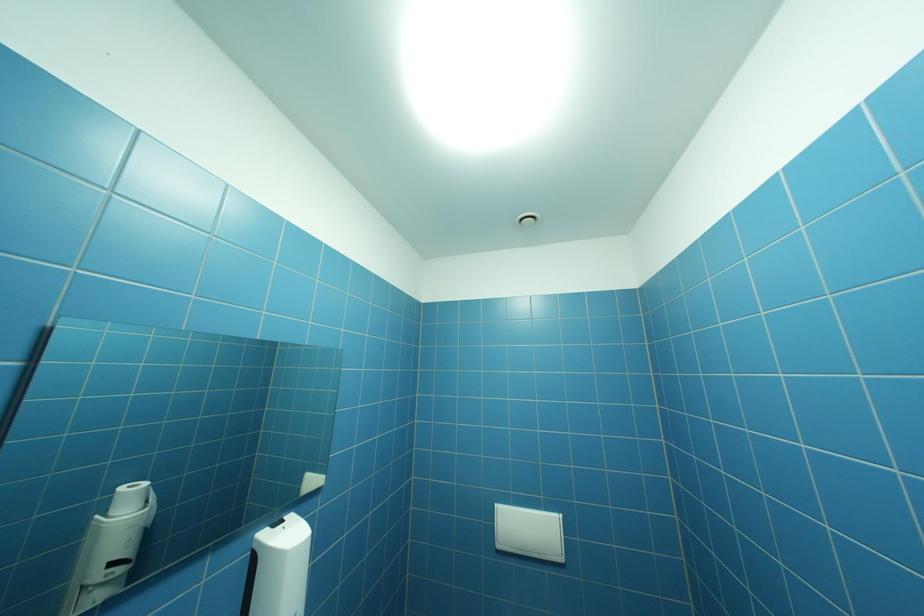
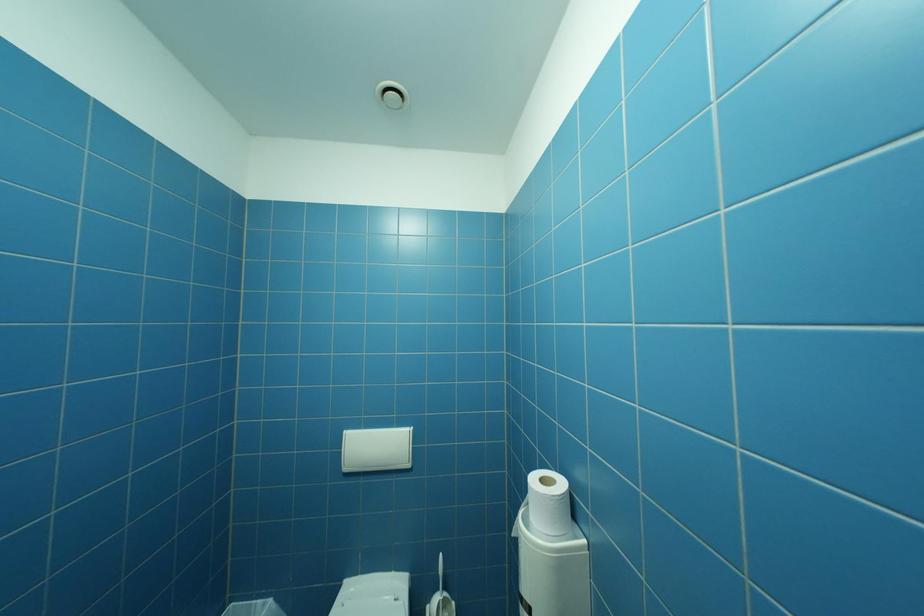
Question: The camera is either moving clockwise (left) or counter-clockwise (right) around the object. The first image is from the beginning of the video and the second image is from the end. Is the camera moving left or right when shooting the video?

Choices:
 (A) Left
 (B) Right

Answer: (A)